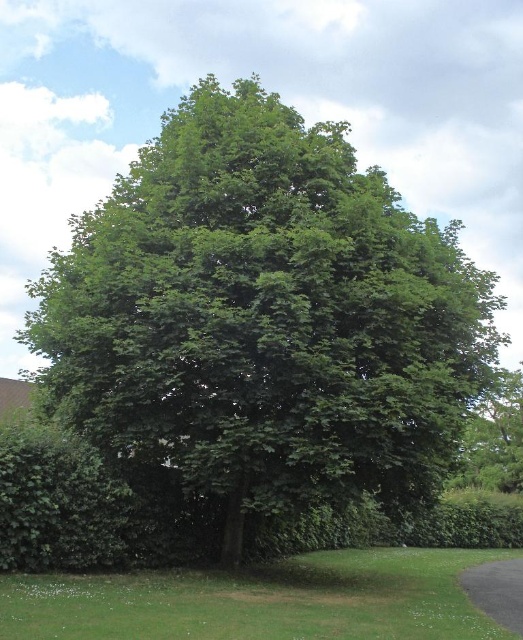
Question: Can you confirm if green leafy tree at center is smaller than black asphalt driveway at lower right?

Choices:
 (A) yes
 (B) no

Answer: (B)

Question: Does green leafy tree at center lie behind black asphalt driveway at lower right?

Choices:
 (A) no
 (B) yes

Answer: (B)

Question: Can you confirm if green leafy tree at center is positioned above black asphalt driveway at lower right?

Choices:
 (A) no
 (B) yes

Answer: (B)

Question: Which point is farther to the camera?

Choices:
 (A) (145, 193)
 (B) (507, 605)

Answer: (A)